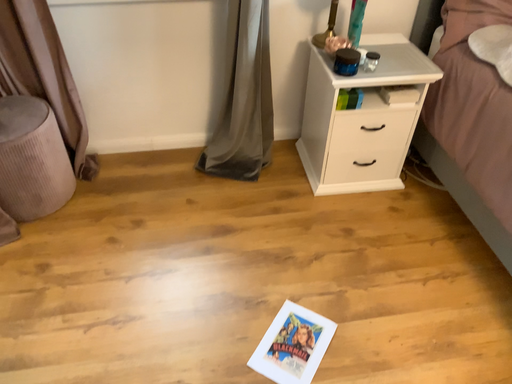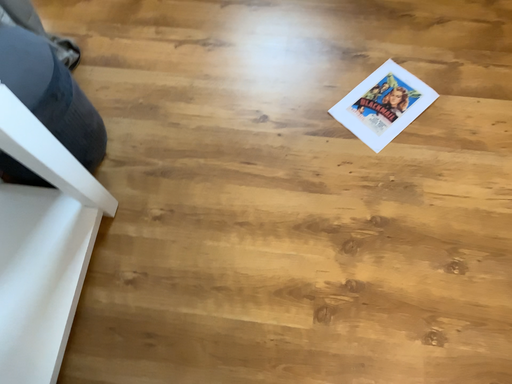
Question: Which way did the camera rotate in the video?

Choices:
 (A) rotated downward
 (B) rotated upward

Answer: (A)